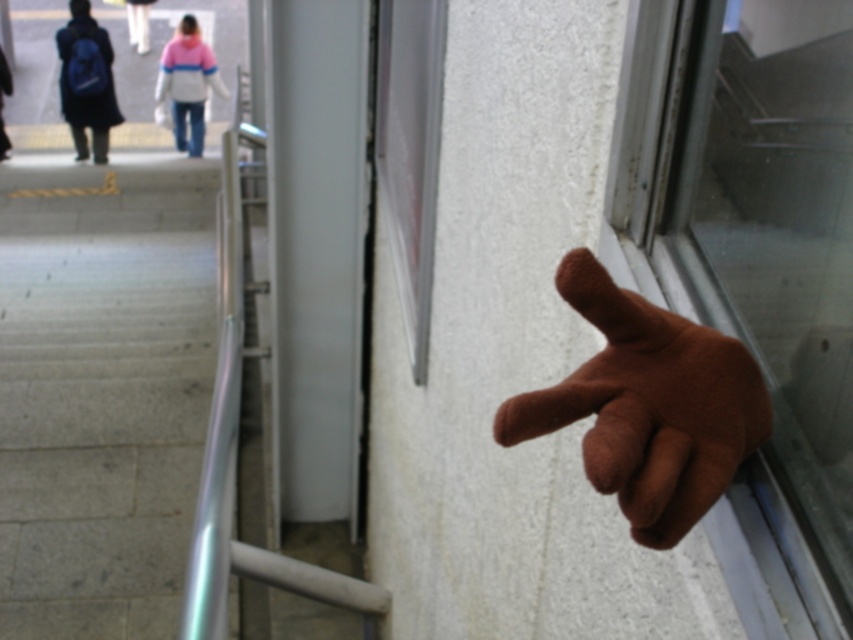
You are standing in the urban scene depicted. You notice the transparent glass window at right and the matte black backpack at upper left. Which object is positioned higher from the ground?

The matte black backpack at upper left is positioned higher from the ground than the transparent glass window at right because the transparent glass window at right is below the matte black backpack at upper left.

You are a delivery person trying to carry a package that is 1 meter wide. You see the transparent glass window at right and the matte black backpack at upper left. Which object can the package fit through or over?

The transparent glass window at right has a width less than the matte black backpack at upper left, so the package cannot fit through the transparent glass window at right. However, the matte black backpack at upper left is wider, so the package might fit over it, but since backpacks are typically not meant for placing packages on, this might not be practical. The question might be better framed around which is wider for passage or placement.